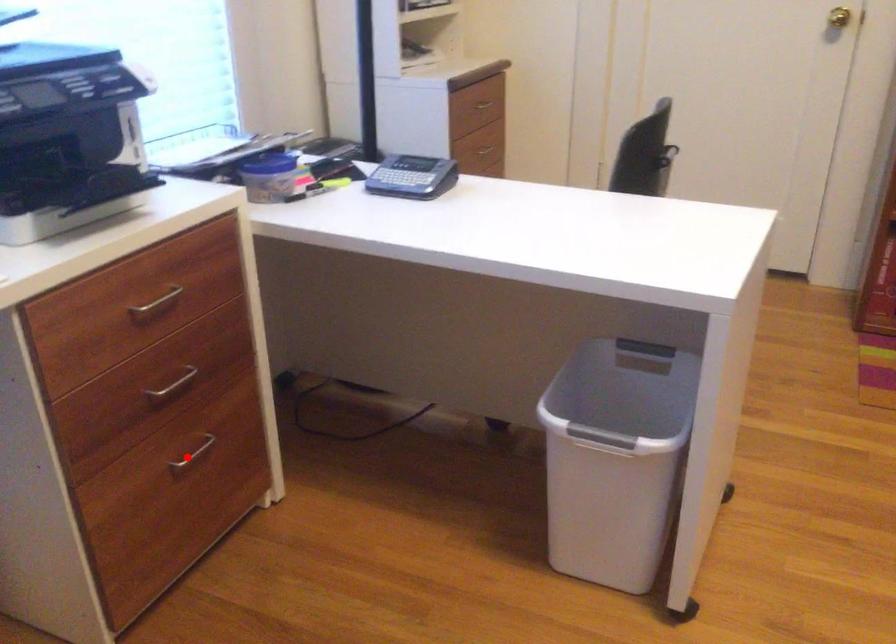
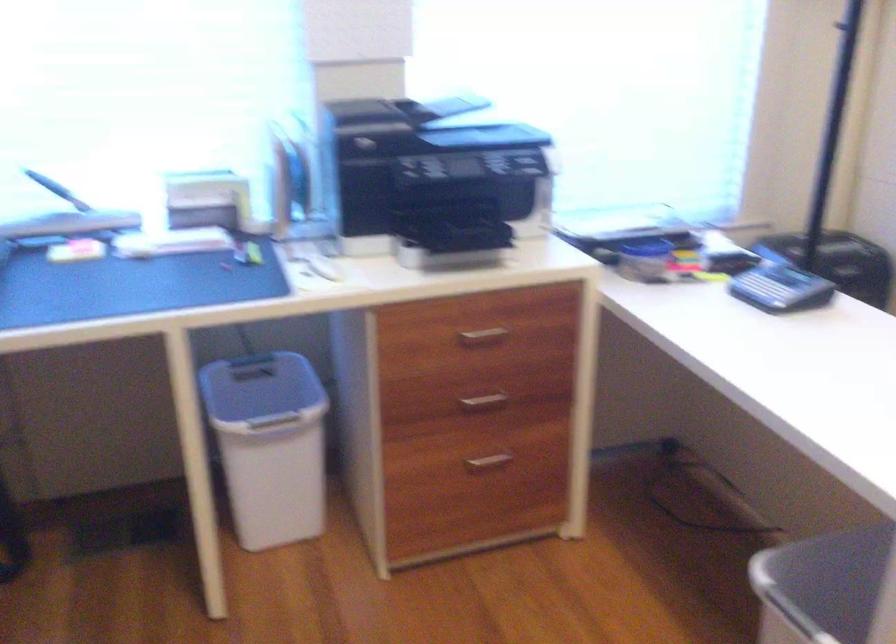
Question: A red point is marked in image1. In image2, is the corresponding 3D point closer to the camera or farther? Reply with the corresponding letter.

Choices:
 (A) The corresponding 3D point is closer.
 (B) The corresponding 3D point is farther.

Answer: (B)